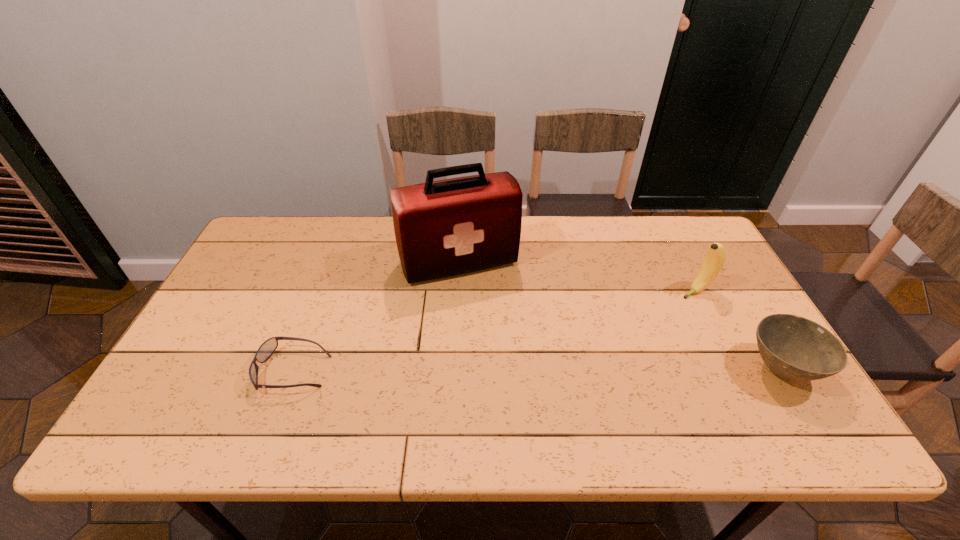
The width and height of the screenshot is (960, 540). In order to click on banana that is at the right edge in this screenshot , I will do `click(716, 256)`.

This screenshot has width=960, height=540. Identify the location of object positioned at the near right corner. (795, 348).

At what (x,y) coordinates should I click in order to perform the action: click on vacant space at the far edge of the desktop. Please return your answer as a coordinate pair (x, y). Looking at the image, I should click on (316, 218).

You are a GUI agent. You are given a task and a screenshot of the screen. Output one action in this format:
    pyautogui.click(x=<x>, y=<y>)
    Task: Click on the blank area at the near edge
    This screenshot has height=540, width=960.
    Given the screenshot: What is the action you would take?
    pyautogui.click(x=256, y=390)

You are a GUI agent. You are given a task and a screenshot of the screen. Output one action in this format:
    pyautogui.click(x=<x>, y=<y>)
    Task: Click on the blank space at the left edge of the desktop
    
    Given the screenshot: What is the action you would take?
    pyautogui.click(x=251, y=342)

Identify the location of vacant space at the right edge of the desktop. This screenshot has height=540, width=960. (688, 301).

At what (x,y) coordinates should I click in order to perform the action: click on free location at the far left corner. Please return your answer as a coordinate pair (x, y). Looking at the image, I should click on (299, 233).

Find the location of `vacant area that lies between the leftmost object and the second shortest object`. vacant area that lies between the leftmost object and the second shortest object is located at coordinates (537, 370).

Locate an element on the screen. The width and height of the screenshot is (960, 540). empty space that is in between the second object from left to right and the banana is located at coordinates (578, 277).

Image resolution: width=960 pixels, height=540 pixels. Identify the location of blank region between the second tallest object and the shortest object. (494, 330).